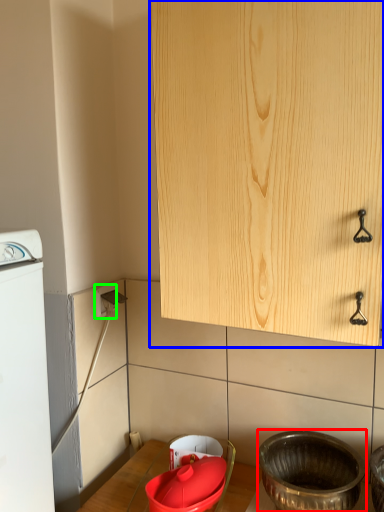
Question: Which is farther away from basin (highlighted by a red box)? cabinetry (highlighted by a blue box) or electric outlet (highlighted by a green box)?

Choices:
 (A) cabinetry
 (B) electric outlet

Answer: (B)